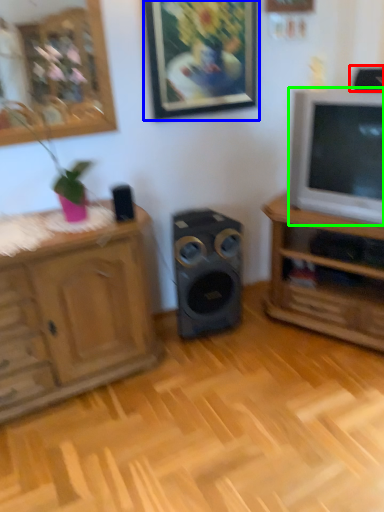
Question: Which object is the closest to the speaker (highlighted by a red box)? Choose among these: picture frame (highlighted by a blue box) or television (highlighted by a green box).

Choices:
 (A) picture frame
 (B) television

Answer: (B)